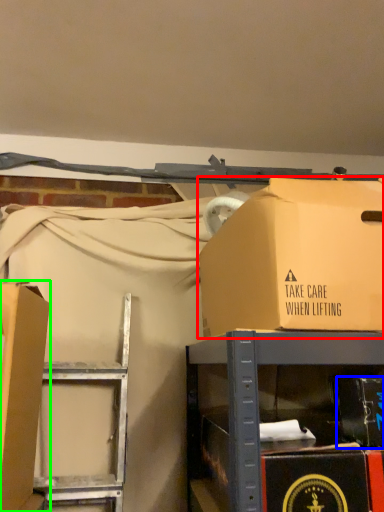
Question: Which object is the farthest from box (highlighted by a red box)? Choose among these: box (highlighted by a blue box) or box (highlighted by a green box).

Choices:
 (A) box
 (B) box

Answer: (B)